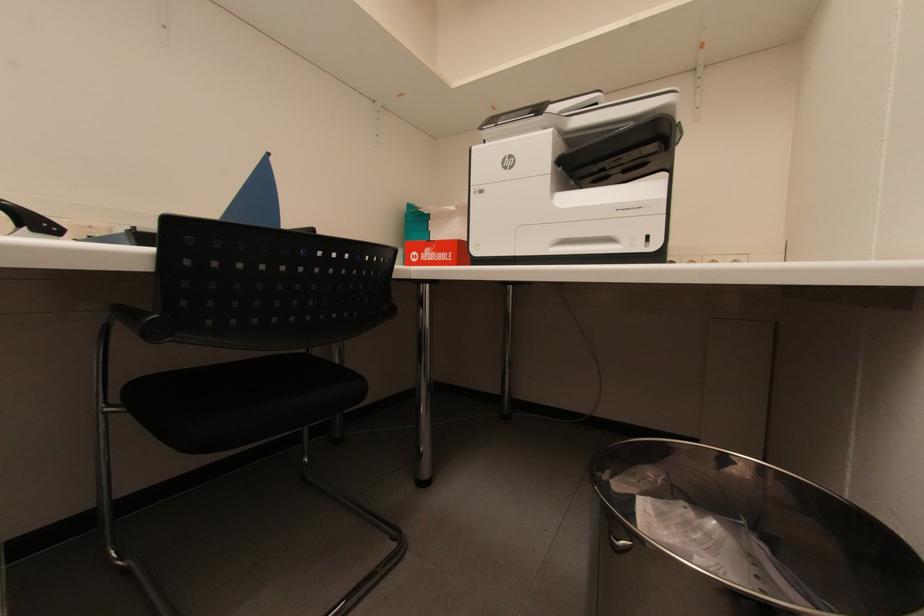
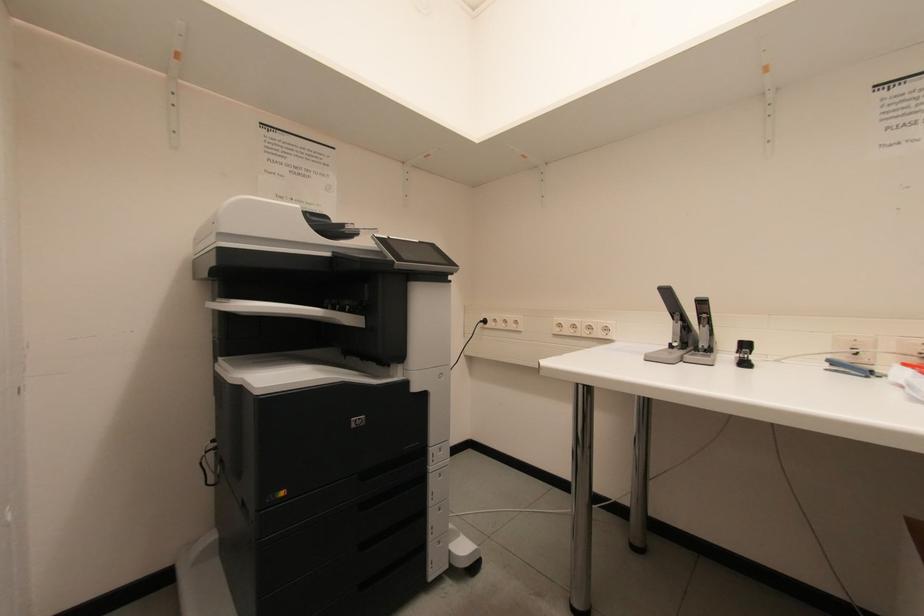
Question: The images are taken continuously from a first-person perspective. In which direction is your viewpoint rotating?

Choices:
 (A) Left
 (B) Right
 (C) Up
 (D) Down

Answer: (A)